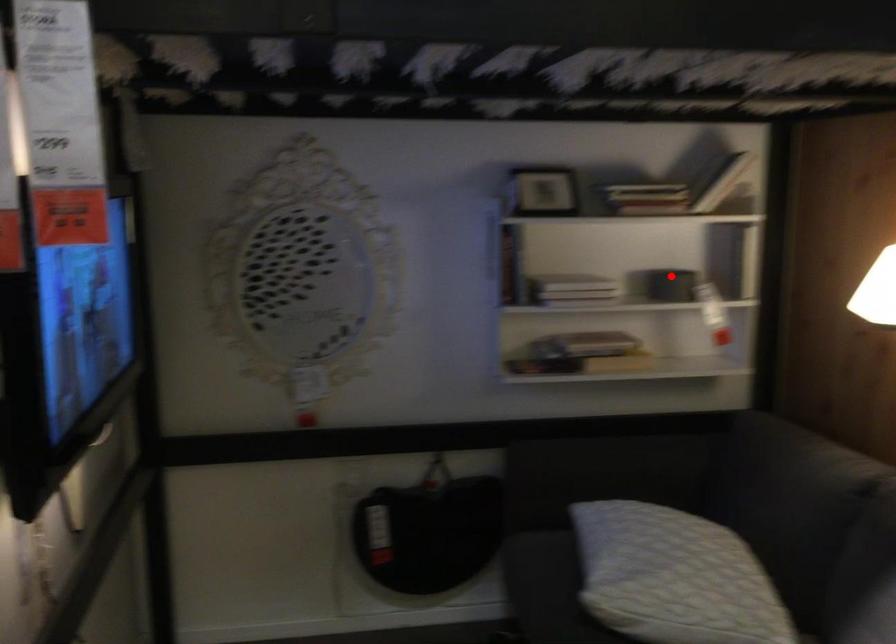
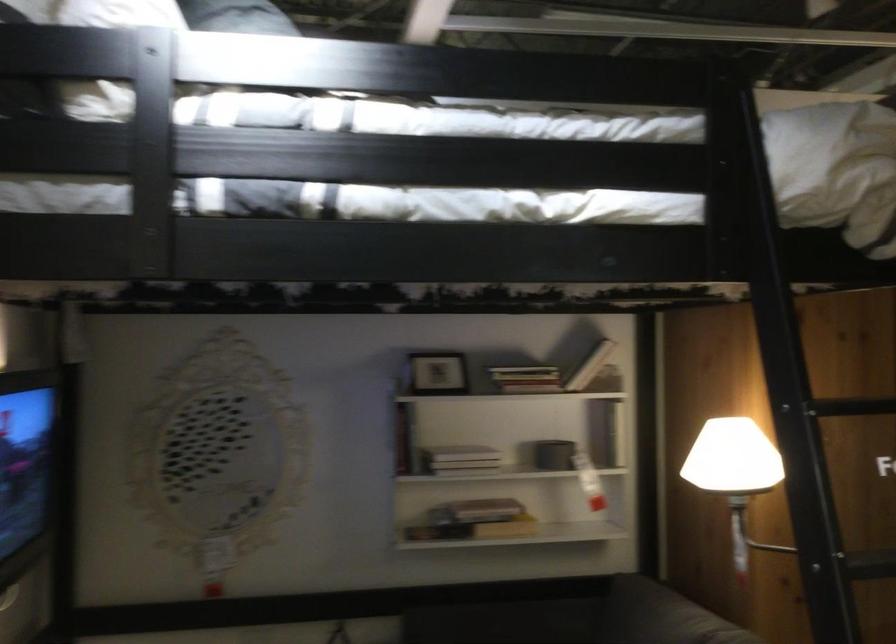
Question: I am providing you with two images of the same scene from different viewpoints. A red point is shown in image1. For the corresponding object point in image2, is it positioned nearer or farther from the camera?

Choices:
 (A) Nearer
 (B) Farther

Answer: (B)